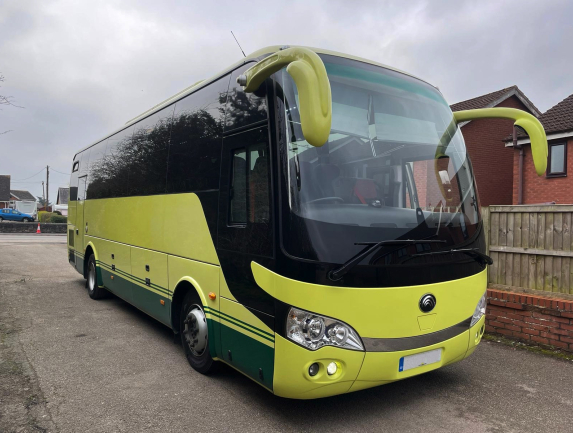
Locate an element on the screen. This screenshot has height=433, width=573. house window is located at coordinates (560, 163).